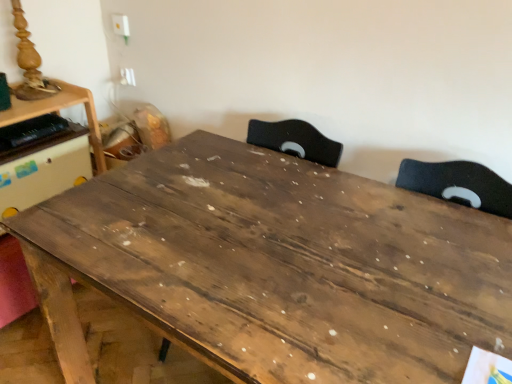
Identify the location of wooden table at left, the second table positioned from the right. (58, 111).

Image resolution: width=512 pixels, height=384 pixels. What do you see at coordinates (58, 111) in the screenshot?
I see `wooden table at left, the second table positioned from the right` at bounding box center [58, 111].

Identify the location of wooden table at center, acting as the second table starting from the left. (275, 267).

Describe the element at coordinates (275, 267) in the screenshot. I see `wooden table at center, acting as the second table starting from the left` at that location.

Where is `wooden table at left, the first table in the left-to-right sequence`? The image size is (512, 384). wooden table at left, the first table in the left-to-right sequence is located at coordinates (58, 111).

Considering the relative positions of wooden table at center, acting as the second table starting from the left, and wooden table at left, the first table in the left-to-right sequence, in the image provided, is wooden table at center, acting as the second table starting from the left, to the left of wooden table at left, the first table in the left-to-right sequence, from the viewer's perspective?

No.

Which object is more forward, wooden table at center, arranged as the first table when viewed from the right, or wooden table at left, the second table positioned from the right?

Positioned in front is wooden table at center, arranged as the first table when viewed from the right.

Is point (269, 315) less distant than point (52, 110)?

Yes.

From the picture: From the image's perspective, between wooden table at center, acting as the second table starting from the left, and wooden table at left, the second table positioned from the right, which one is located above?

wooden table at left, the second table positioned from the right, from the image's perspective.

Consider the image. From a real-world perspective, is wooden table at center, arranged as the first table when viewed from the right, physically located above or below wooden table at left, the second table positioned from the right?

wooden table at center, arranged as the first table when viewed from the right, is below wooden table at left, the second table positioned from the right.

Considering the relative sizes of wooden table at center, arranged as the first table when viewed from the right, and wooden table at left, the second table positioned from the right, in the image provided, is wooden table at center, arranged as the first table when viewed from the right, thinner than wooden table at left, the second table positioned from the right,?

No, wooden table at center, arranged as the first table when viewed from the right, is not thinner than wooden table at left, the second table positioned from the right.

Considering the relative sizes of wooden table at center, acting as the second table starting from the left, and wooden table at left, the first table in the left-to-right sequence, in the image provided, is wooden table at center, acting as the second table starting from the left, shorter than wooden table at left, the first table in the left-to-right sequence,?

Incorrect, the height of wooden table at center, acting as the second table starting from the left, does not fall short of that of wooden table at left, the first table in the left-to-right sequence.

Considering the sizes of wooden table at center, arranged as the first table when viewed from the right, and wooden table at left, the second table positioned from the right, in the image, is wooden table at center, arranged as the first table when viewed from the right, bigger or smaller than wooden table at left, the second table positioned from the right,?

In the image, wooden table at center, arranged as the first table when viewed from the right, appears to be larger than wooden table at left, the second table positioned from the right.

From the picture: Is wooden table at center, acting as the second table starting from the left, spatially inside wooden table at left, the first table in the left-to-right sequence, or outside of it?

wooden table at center, acting as the second table starting from the left, lies outside wooden table at left, the first table in the left-to-right sequence.

Are wooden table at center, acting as the second table starting from the left, and wooden table at left, the first table in the left-to-right sequence, far apart?

No, wooden table at center, acting as the second table starting from the left, is not far from wooden table at left, the first table in the left-to-right sequence.

Consider the image. Is wooden table at center, arranged as the first table when viewed from the right, facing towards wooden table at left, the second table positioned from the right?

No, wooden table at center, arranged as the first table when viewed from the right, is not turned towards wooden table at left, the second table positioned from the right.

Measure the distance from wooden table at center, acting as the second table starting from the left, to wooden table at left, the first table in the left-to-right sequence.

wooden table at center, acting as the second table starting from the left, and wooden table at left, the first table in the left-to-right sequence, are 89.57 centimeters apart.

The height and width of the screenshot is (384, 512). Identify the location of table located on the right of wooden table at left, the second table positioned from the right. (275, 267).

Can you confirm if wooden table at left, the second table positioned from the right, is positioned to the right of wooden table at center, acting as the second table starting from the left?

No.

Considering the positions of objects wooden table at left, the first table in the left-to-right sequence, and wooden table at center, arranged as the first table when viewed from the right, in the image provided, who is in front, wooden table at left, the first table in the left-to-right sequence, or wooden table at center, arranged as the first table when viewed from the right,?

wooden table at center, arranged as the first table when viewed from the right, is in front.

Does point (33, 105) appear closer or farther from the camera than point (460, 209)?

Point (33, 105) is positioned farther from the camera compared to point (460, 209).

From the image's perspective, is wooden table at left, the second table positioned from the right, over wooden table at center, acting as the second table starting from the left?

Correct, wooden table at left, the second table positioned from the right, appears higher than wooden table at center, acting as the second table starting from the left, in the image.

From a real-world perspective, is wooden table at left, the second table positioned from the right, positioned over wooden table at center, acting as the second table starting from the left, based on gravity?

Yes, from a real-world perspective, wooden table at left, the second table positioned from the right, is above wooden table at center, acting as the second table starting from the left.

Which of these two, wooden table at left, the second table positioned from the right, or wooden table at center, arranged as the first table when viewed from the right, is thinner?

wooden table at left, the second table positioned from the right, is thinner.

Can you confirm if wooden table at left, the first table in the left-to-right sequence, is taller than wooden table at center, arranged as the first table when viewed from the right?

No.

Who is smaller, wooden table at left, the second table positioned from the right, or wooden table at center, acting as the second table starting from the left?

wooden table at left, the second table positioned from the right.

Is wooden table at left, the second table positioned from the right, located outside wooden table at center, acting as the second table starting from the left?

Yes, wooden table at left, the second table positioned from the right, is located beyond the bounds of wooden table at center, acting as the second table starting from the left.

Is wooden table at left, the first table in the left-to-right sequence, next to wooden table at center, arranged as the first table when viewed from the right?

wooden table at left, the first table in the left-to-right sequence, is not next to wooden table at center, arranged as the first table when viewed from the right, and they're not touching.

Is wooden table at left, the first table in the left-to-right sequence, facing towards wooden table at center, arranged as the first table when viewed from the right?

Yes, wooden table at left, the first table in the left-to-right sequence, faces towards wooden table at center, arranged as the first table when viewed from the right.

Locate an element on the screen. The image size is (512, 384). table that is on the left side of wooden table at center, arranged as the first table when viewed from the right is located at coordinates (58, 111).

Locate an element on the screen. The width and height of the screenshot is (512, 384). table on the right of wooden table at left, the second table positioned from the right is located at coordinates (275, 267).

I want to click on table above the wooden table at center, arranged as the first table when viewed from the right (from the image's perspective), so click(x=58, y=111).